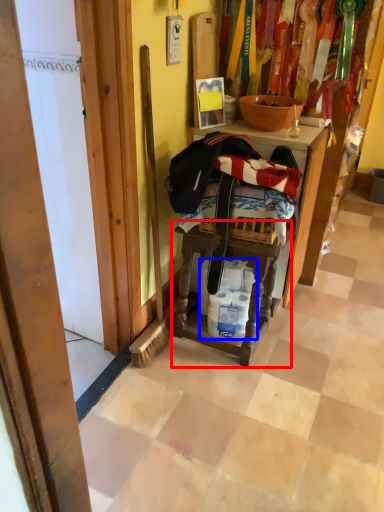
Question: Which of the following is the farthest to the observer, step stool (highlighted by a red box) or toilet paper (highlighted by a blue box)?

Choices:
 (A) step stool
 (B) toilet paper

Answer: (B)